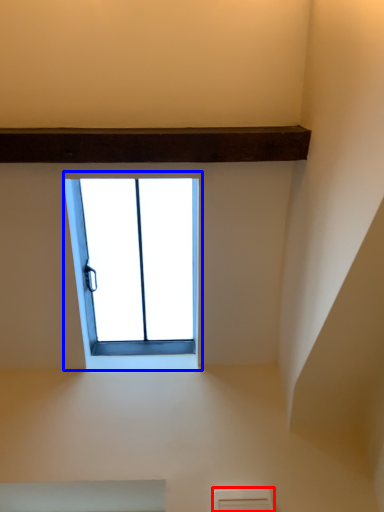
Question: Which of the following is the closest to the observer, air conditioning (highlighted by a red box) or window (highlighted by a blue box)?

Choices:
 (A) air conditioning
 (B) window

Answer: (B)